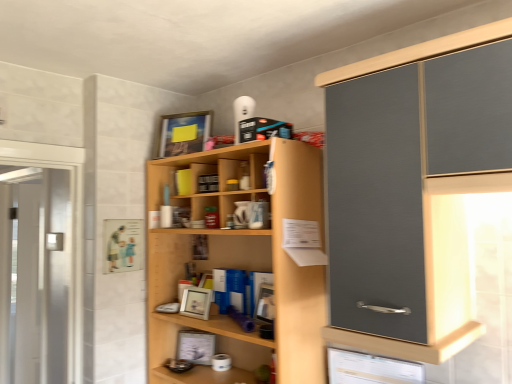
Find the location of a particular element. Image resolution: width=512 pixels, height=384 pixels. transparent glass screen door at left is located at coordinates (38, 276).

What is the approximate width of white matte picture frame at center, the 2th picture frame when ordered from bottom to top?

white matte picture frame at center, the 2th picture frame when ordered from bottom to top, is 7.53 centimeters wide.

The width and height of the screenshot is (512, 384). Identify the location of transparent glass screen door at left. (38, 276).

Based on the photo, which is farther, (229, 233) or (10, 362)?

The point (10, 362) is more distant.

Which is in front, light wood cupboard at center or transparent glass screen door at left?

light wood cupboard at center is more forward.

From the image's perspective, does light wood cupboard at center appear lower than transparent glass screen door at left?

No, from the image's perspective, light wood cupboard at center is not below transparent glass screen door at left.

Who is shorter, matte wooden picture frame at upper center, placed as the third picture frame when sorted from bottom to top, or metallic silver picture frame at lower center, the third picture frame positioned from the top?

metallic silver picture frame at lower center, the third picture frame positioned from the top.

Between point (164, 118) and point (195, 349), which one is positioned in front?

The point (195, 349) is more forward.

Is metallic silver picture frame at lower center, the third picture frame positioned from the top, a part of matte wooden picture frame at upper center, placed as the third picture frame when sorted from bottom to top?

No, metallic silver picture frame at lower center, the third picture frame positioned from the top, is located outside of matte wooden picture frame at upper center, placed as the third picture frame when sorted from bottom to top.

Consider the image. Considering the relative sizes of matte wooden picture frame at upper center, which is the first picture frame in top-to-bottom order, and metallic silver picture frame at lower center, the third picture frame positioned from the top, in the image provided, is matte wooden picture frame at upper center, which is the first picture frame in top-to-bottom order, wider than metallic silver picture frame at lower center, the third picture frame positioned from the top,?

Correct, the width of matte wooden picture frame at upper center, which is the first picture frame in top-to-bottom order, exceeds that of metallic silver picture frame at lower center, the third picture frame positioned from the top.

Is transparent glass screen door at left shorter than matte wooden picture frame at upper center, which is the first picture frame in top-to-bottom order?

No.

Considering the points (32, 378) and (169, 147), which point is behind, point (32, 378) or point (169, 147)?

The point (32, 378) is farther.

How different are the orientations of transparent glass screen door at left and matte wooden picture frame at upper center, which is the first picture frame in top-to-bottom order, in degrees?

There is a 23.4-degree angle between the facing directions of transparent glass screen door at left and matte wooden picture frame at upper center, which is the first picture frame in top-to-bottom order.

Is transparent glass screen door at left facing towards matte wooden picture frame at upper center, placed as the third picture frame when sorted from bottom to top?

No, transparent glass screen door at left is not oriented towards matte wooden picture frame at upper center, placed as the third picture frame when sorted from bottom to top.

Does transparent glass screen door at left contain white matte picture frame at center, the 2th picture frame when ordered from bottom to top?

No, white matte picture frame at center, the 2th picture frame when ordered from bottom to top, is not surrounded by transparent glass screen door at left.

From a real-world perspective, is transparent glass screen door at left located beneath white matte picture frame at center, which ranks as the 2th picture frame in top-to-bottom order?

Indeed, from a real-world perspective, transparent glass screen door at left is positioned beneath white matte picture frame at center, which ranks as the 2th picture frame in top-to-bottom order.

How different are the orientations of transparent glass screen door at left and white matte picture frame at center, which ranks as the 2th picture frame in top-to-bottom order, in degrees?

The angular difference between transparent glass screen door at left and white matte picture frame at center, which ranks as the 2th picture frame in top-to-bottom order, is 2.46 degrees.

Which object is more forward, transparent glass screen door at left or white matte picture frame at center, which ranks as the 2th picture frame in top-to-bottom order?

white matte picture frame at center, which ranks as the 2th picture frame in top-to-bottom order.

How many degrees apart are the facing directions of transparent glass screen door at left and light wood cupboard at center?

0.573 degrees separate the facing orientations of transparent glass screen door at left and light wood cupboard at center.

From the image's perspective, is transparent glass screen door at left above or below light wood cupboard at center?

Based on their image positions, transparent glass screen door at left is located beneath light wood cupboard at center.

The height and width of the screenshot is (384, 512). Find the location of `screen door located behind the light wood cupboard at center`. screen door located behind the light wood cupboard at center is located at coordinates (38, 276).

Is transparent glass screen door at left in contact with light wood cupboard at center?

No.

Does light wood cupboard at center appear on the left side of white matte picture frame at center, which ranks as the 2th picture frame in top-to-bottom order?

No.

Is point (315, 198) behind point (198, 295)?

No.

You are a GUI agent. You are given a task and a screenshot of the screen. Output one action in this format:
    pyautogui.click(x=<x>, y=<y>)
    Task: Click on the 1st picture frame to the left of the light wood cupboard at center, counting from the anchor's position
    
    Given the screenshot: What is the action you would take?
    pyautogui.click(x=196, y=302)

Is light wood cupboard at center at the left side of matte wooden picture frame at upper center, placed as the third picture frame when sorted from bottom to top?

No.

Are light wood cupboard at center and matte wooden picture frame at upper center, placed as the third picture frame when sorted from bottom to top, making contact?

No, light wood cupboard at center is not beside matte wooden picture frame at upper center, placed as the third picture frame when sorted from bottom to top.

Measure the distance from light wood cupboard at center to matte wooden picture frame at upper center, which is the first picture frame in top-to-bottom order.

A distance of 18.09 inches exists between light wood cupboard at center and matte wooden picture frame at upper center, which is the first picture frame in top-to-bottom order.

Considering the points (161, 288) and (200, 143), which point is behind, point (161, 288) or point (200, 143)?

Point (161, 288)

Locate an element on the screen. Image resolution: width=512 pixels, height=384 pixels. screen door behind the light wood cupboard at center is located at coordinates pos(38,276).

Starting from the matte wooden picture frame at upper center, placed as the third picture frame when sorted from bottom to top, which picture frame is the 1st one to the right? Please provide its 2D coordinates.

[(196, 346)]

Looking at the image, which one is located closer to transparent glass screen door at left, metallic silver picture frame at lower center, which appears as the first picture frame when ordered from the bottom, or matte wooden picture frame at upper center, placed as the third picture frame when sorted from bottom to top?

Among the two, metallic silver picture frame at lower center, which appears as the first picture frame when ordered from the bottom, is located nearer to transparent glass screen door at left.

When comparing their distances from metallic silver picture frame at lower center, which appears as the first picture frame when ordered from the bottom, does transparent glass screen door at left or light wood cupboard at center seem further?

transparent glass screen door at left.

From the image, which object appears to be nearer to metallic silver picture frame at lower center, the third picture frame positioned from the top, transparent glass screen door at left or white matte picture frame at center, which ranks as the 2th picture frame in top-to-bottom order?

white matte picture frame at center, which ranks as the 2th picture frame in top-to-bottom order, is closer to metallic silver picture frame at lower center, the third picture frame positioned from the top.

Based on their spatial positions, is white matte picture frame at center, the 2th picture frame when ordered from bottom to top, or matte wooden picture frame at upper center, which is the first picture frame in top-to-bottom order, closer to light wood cupboard at center?

white matte picture frame at center, the 2th picture frame when ordered from bottom to top, is closer to light wood cupboard at center.

Looking at the image, which one is located closer to metallic silver picture frame at lower center, the third picture frame positioned from the top, transparent glass screen door at left or matte wooden picture frame at upper center, placed as the third picture frame when sorted from bottom to top?

The object closer to metallic silver picture frame at lower center, the third picture frame positioned from the top, is matte wooden picture frame at upper center, placed as the third picture frame when sorted from bottom to top.

Based on their spatial positions, is light wood cupboard at center or metallic silver picture frame at lower center, which appears as the first picture frame when ordered from the bottom, further from transparent glass screen door at left?

light wood cupboard at center.

Considering their positions, is light wood cupboard at center positioned further to metallic silver picture frame at lower center, which appears as the first picture frame when ordered from the bottom, than transparent glass screen door at left?

Based on the image, transparent glass screen door at left appears to be further to metallic silver picture frame at lower center, which appears as the first picture frame when ordered from the bottom.

Based on their spatial positions, is white matte picture frame at center, which ranks as the 2th picture frame in top-to-bottom order, or transparent glass screen door at left closer to light wood cupboard at center?

The object closer to light wood cupboard at center is white matte picture frame at center, which ranks as the 2th picture frame in top-to-bottom order.

Find the location of a particular element. cupboard between matte wooden picture frame at upper center, placed as the third picture frame when sorted from bottom to top, and white matte picture frame at center, the 2th picture frame when ordered from bottom to top, in the up-down direction is located at coordinates (241, 263).

Where is `picture frame between transparent glass screen door at left and metallic silver picture frame at lower center, which appears as the first picture frame when ordered from the bottom, from left to right`? The image size is (512, 384). picture frame between transparent glass screen door at left and metallic silver picture frame at lower center, which appears as the first picture frame when ordered from the bottom, from left to right is located at coordinates (184, 133).

I want to click on picture frame between matte wooden picture frame at upper center, placed as the third picture frame when sorted from bottom to top, and metallic silver picture frame at lower center, which appears as the first picture frame when ordered from the bottom, in the vertical direction, so click(196, 302).

Where is `cupboard between matte wooden picture frame at upper center, which is the first picture frame in top-to-bottom order, and metallic silver picture frame at lower center, which appears as the first picture frame when ordered from the bottom, from top to bottom`? This screenshot has height=384, width=512. cupboard between matte wooden picture frame at upper center, which is the first picture frame in top-to-bottom order, and metallic silver picture frame at lower center, which appears as the first picture frame when ordered from the bottom, from top to bottom is located at coordinates pos(241,263).